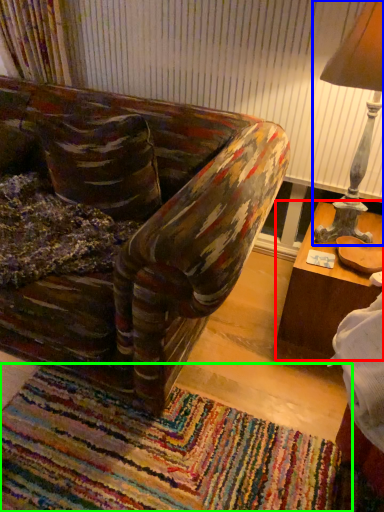
Question: Which object is positioned farthest from table (highlighted by a red box)? Select from table lamp (highlighted by a blue box) and mat (highlighted by a green box).

Choices:
 (A) table lamp
 (B) mat

Answer: (B)